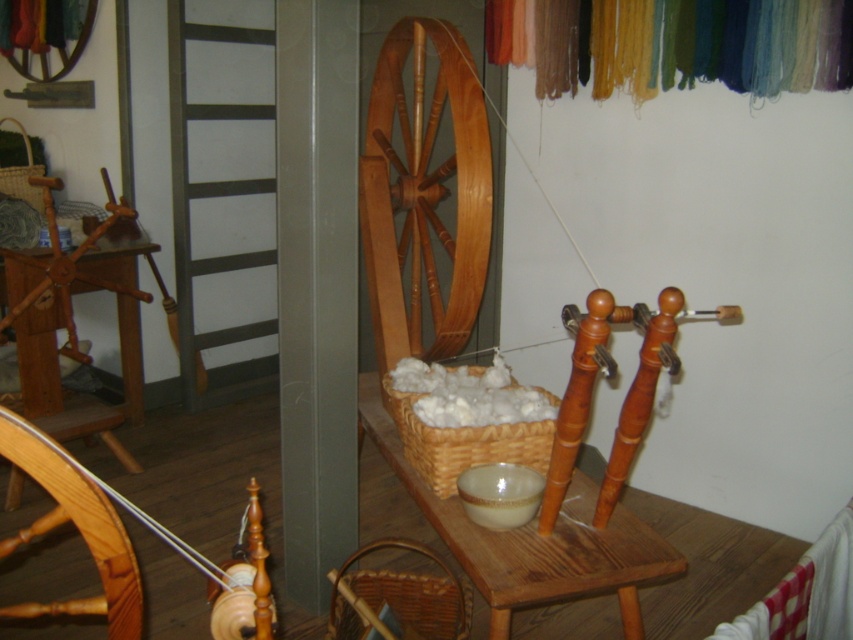
Question: Which object is closer to the camera taking this photo?

Choices:
 (A) wooden spinning wheel at lower left
 (B) woven brown basket at lower center
 (C) silky woolen yarns at upper right
 (D) wooden spinning wheel at center

Answer: (A)

Question: From the image, what is the correct spatial relationship of wooden spinning wheel at center in relation to silky woolen yarns at upper right?

Choices:
 (A) below
 (B) above

Answer: (A)

Question: Which point is closer to the camera?

Choices:
 (A) (453, 458)
 (B) (607, 68)

Answer: (A)

Question: Is woven wicker basket at center wider than woven straw basket at left?

Choices:
 (A) yes
 (B) no

Answer: (B)

Question: Which object is positioned farthest from the silky woolen yarns at upper right?

Choices:
 (A) wooden spinning wheel at center
 (B) woven brown basket at lower center
 (C) wooden spinning wheel at lower left

Answer: (C)

Question: Is wooden spinning wheel at center above woven wicker basket at center?

Choices:
 (A) no
 (B) yes

Answer: (B)